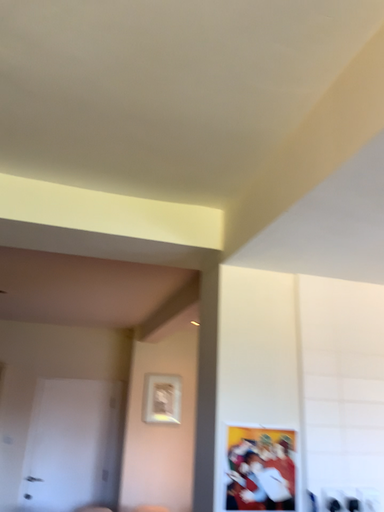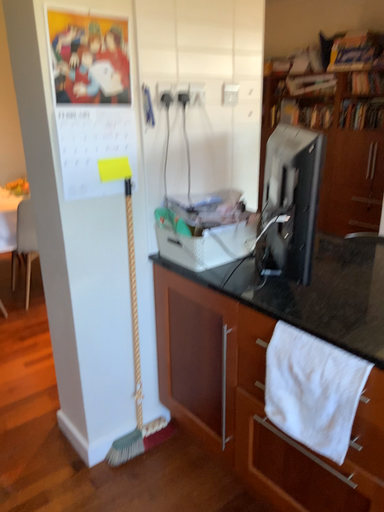
Question: Which way did the camera rotate in the video?

Choices:
 (A) rotated upward
 (B) rotated downward

Answer: (B)